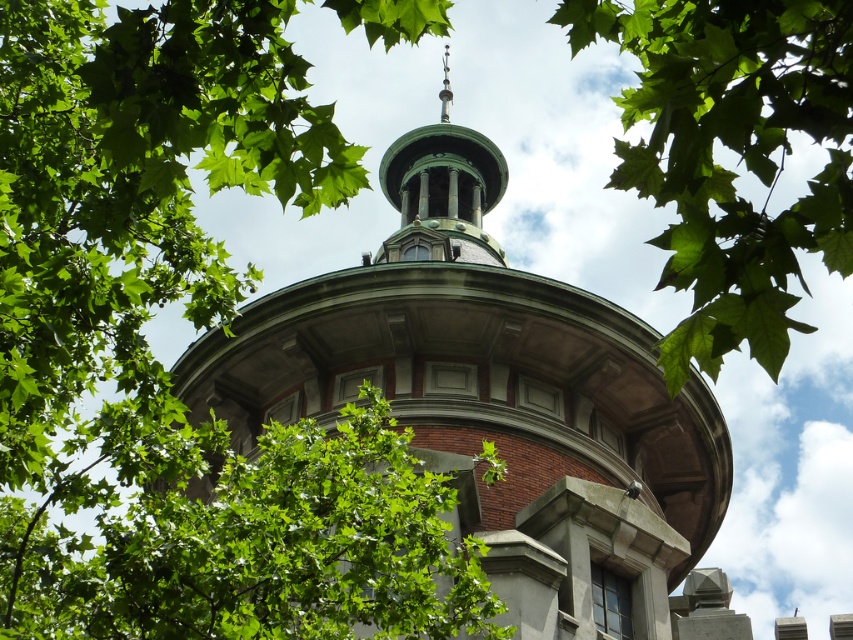
Question: Which point is closer to the camera?

Choices:
 (A) green leafy tree at upper center
 (B) green polished dome at center

Answer: (A)

Question: Can you confirm if green polished dome at center is positioned below green leafy tree at upper center?

Choices:
 (A) yes
 (B) no

Answer: (A)

Question: In this image, where is green polished dome at center located relative to green leafy tree at upper center?

Choices:
 (A) left
 (B) right

Answer: (A)

Question: Does green polished dome at center have a smaller size compared to green leafy tree at upper center?

Choices:
 (A) yes
 (B) no

Answer: (B)

Question: Which of the following is the farthest from the observer?

Choices:
 (A) green polished dome at center
 (B) green leafy tree at upper center

Answer: (A)